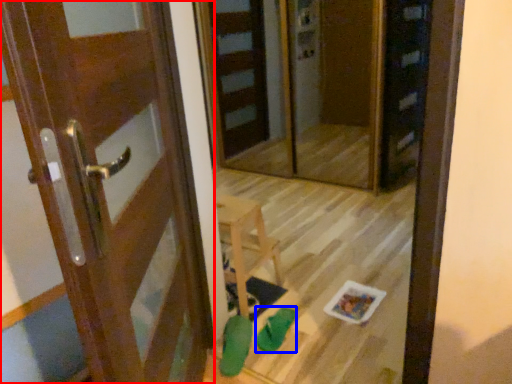
Question: Which object is further to the camera taking this photo, door (highlighted by a red box) or shoe (highlighted by a blue box)?

Choices:
 (A) door
 (B) shoe

Answer: (B)